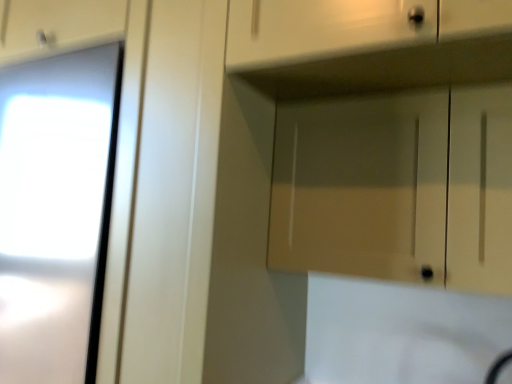
Question: Considering the relative sizes of matte white drawer at upper right and matte wood cabinet at upper center in the image provided, is matte white drawer at upper right thinner than matte wood cabinet at upper center?

Choices:
 (A) no
 (B) yes

Answer: (A)

Question: Is matte wood cabinet at upper center at the back of matte white drawer at upper right?

Choices:
 (A) yes
 (B) no

Answer: (B)

Question: Is matte white drawer at upper right at the left side of matte wood cabinet at upper center?

Choices:
 (A) no
 (B) yes

Answer: (B)

Question: Could you tell me if matte white drawer at upper right is turned towards matte wood cabinet at upper center?

Choices:
 (A) no
 (B) yes

Answer: (A)

Question: Would you say matte white drawer at upper right contains matte wood cabinet at upper center?

Choices:
 (A) yes
 (B) no

Answer: (B)

Question: Considering the relative sizes of matte white drawer at upper right and matte wood cabinet at upper center in the image provided, is matte white drawer at upper right taller than matte wood cabinet at upper center?

Choices:
 (A) no
 (B) yes

Answer: (A)

Question: From the image's perspective, is matte wood cabinet at upper center beneath matte white drawer at upper right?

Choices:
 (A) yes
 (B) no

Answer: (A)

Question: Considering the relative sizes of matte wood cabinet at upper center and matte white drawer at upper right in the image provided, is matte wood cabinet at upper center taller than matte white drawer at upper right?

Choices:
 (A) yes
 (B) no

Answer: (A)

Question: Does matte wood cabinet at upper center have a smaller size compared to matte white drawer at upper right?

Choices:
 (A) yes
 (B) no

Answer: (A)

Question: Is matte white drawer at upper right inside matte wood cabinet at upper center?

Choices:
 (A) no
 (B) yes

Answer: (A)

Question: From a real-world perspective, is matte wood cabinet at upper center positioned under matte white drawer at upper right based on gravity?

Choices:
 (A) no
 (B) yes

Answer: (B)

Question: From the image's perspective, is matte wood cabinet at upper center over matte white drawer at upper right?

Choices:
 (A) no
 (B) yes

Answer: (A)

Question: Considering the relative positions of matte wood cabinet at upper center and matte white drawer at upper right in the image provided, is matte wood cabinet at upper center to the left or to the right of matte white drawer at upper right?

Choices:
 (A) left
 (B) right

Answer: (B)